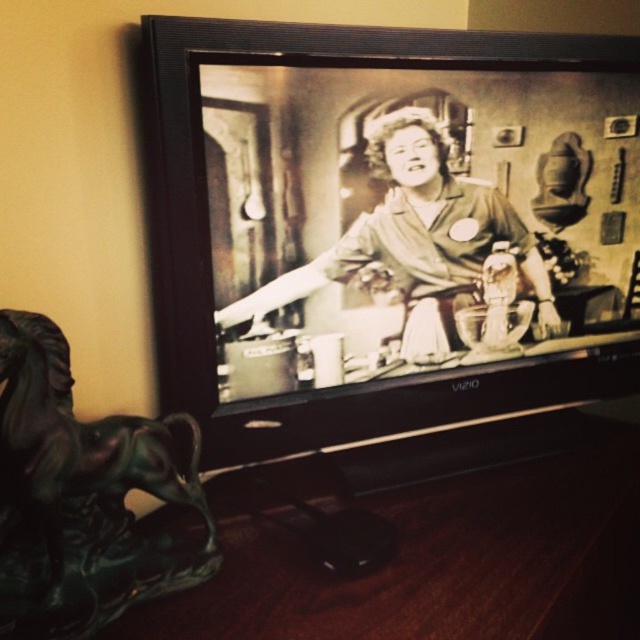
Is black matte television at center below matte black dress at center?

Actually, black matte television at center is above matte black dress at center.

At what (x,y) coordinates should I click in order to perform the action: click on black matte television at center. Please return your answer as a coordinate pair (x, y). Looking at the image, I should click on (387, 227).

Is point (422, 76) farther from camera compared to point (440, 289)?

No, it is not.

The width and height of the screenshot is (640, 640). I want to click on black matte television at center, so click(387, 227).